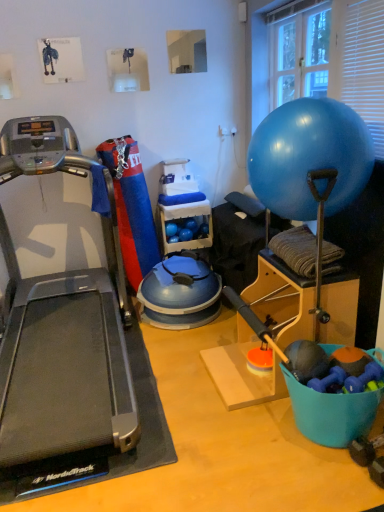
Question: From the image's perspective, is blue plastic bucket at lower right located above or below silver/black treadmill at left?

Choices:
 (A) below
 (B) above

Answer: (A)

Question: In the image, is blue plastic bucket at lower right on the left side or the right side of silver/black treadmill at left?

Choices:
 (A) left
 (B) right

Answer: (B)

Question: Which object is positioned closest to the blue rubber ball at upper right?

Choices:
 (A) transparent glass window at upper right
 (B) blue plastic bucket at lower right
 (C) blue rubber ball at center
 (D) silver/black treadmill at left

Answer: (B)

Question: Which object is the farthest from the transparent glass window at upper right?

Choices:
 (A) blue plastic bucket at lower right
 (B) silver/black treadmill at left
 (C) blue rubber ball at upper right
 (D) blue rubber ball at center

Answer: (A)